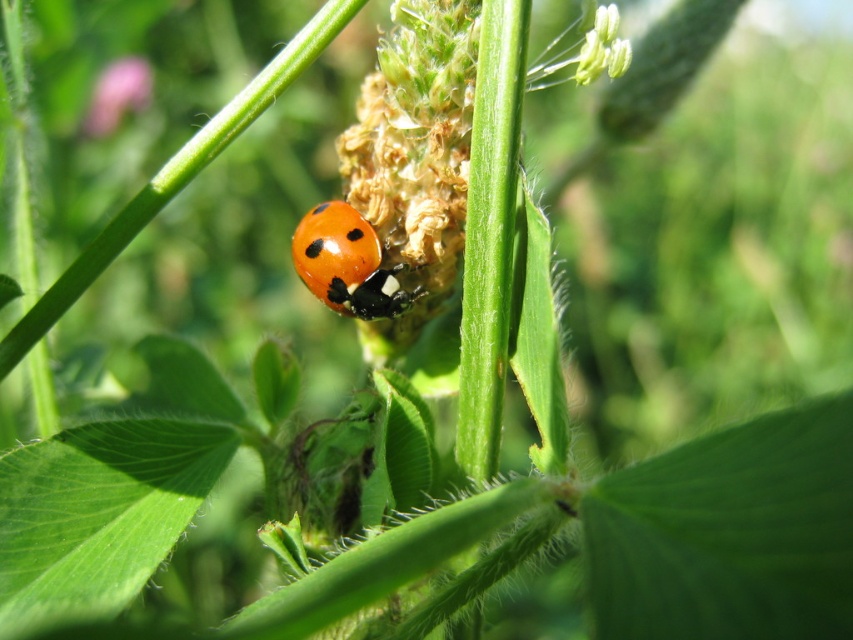
Is shiny orange ladybird at center positioned behind smooth pink flower at upper left?

No, it is in front of smooth pink flower at upper left.

Between shiny orange ladybird at center and smooth pink flower at upper left, which one appears on the left side from the viewer's perspective?

smooth pink flower at upper left is more to the left.

Between point (311, 284) and point (108, 72), which one is positioned in front?

Point (311, 284) is in front.

Find the location of `shiny orange ladybird at center`. shiny orange ladybird at center is located at coordinates (347, 262).